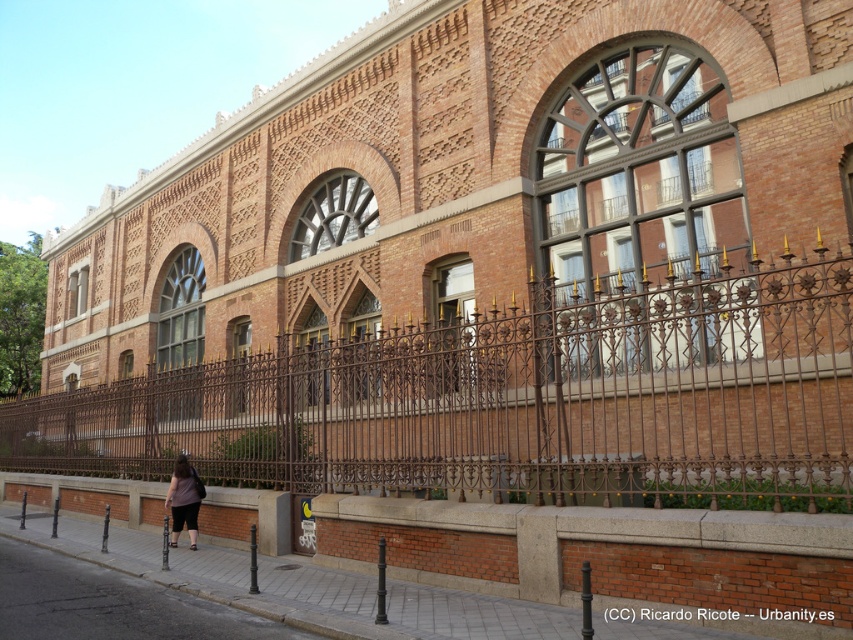
You are standing in front of the historic brick building and want to take a photo. You notice two points marked on the building facade. The first point is at coordinate point (67, 625) and the second is at point (175, 506). Which point will appear larger in your camera view?

Point (67, 625) is closer to the camera than point (175, 506). Since objects closer to the camera appear larger in the photo, point (67, 625) will appear larger in the camera view.

You are a delivery person trying to determine the best path to approach the historic brick building. You notice the brown wrought iron fence at center and the gray concrete sidewalk at lower left. Which of these two objects is larger in size?

The brown wrought iron fence at center is bigger than the gray concrete sidewalk at lower left, so the brown wrought iron fence at center is larger in size.